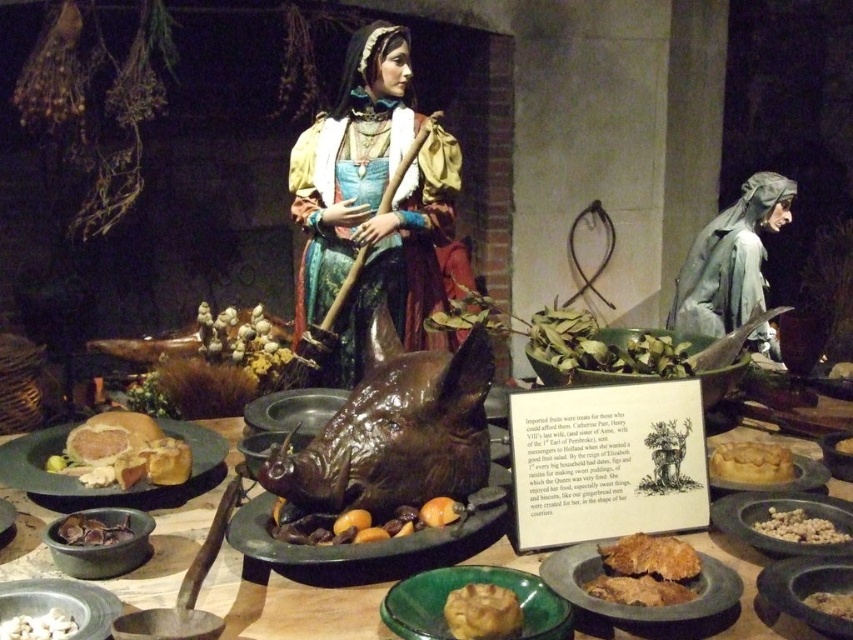
Question: Which object is farther from the camera taking this photo?

Choices:
 (A) matte gray bowl at lower left
 (B) brown matte beans at lower right
 (C) shiny brown mushrooms at center

Answer: (B)

Question: Can you confirm if shiny silver platter at center is positioned below brown matte bread at center?

Choices:
 (A) no
 (B) yes

Answer: (B)

Question: Is shiny brown pig head at center bigger than matte brown bowl at lower right?

Choices:
 (A) no
 (B) yes

Answer: (B)

Question: Does brown crumbly pastry at lower right have a larger size compared to orange matte fruit at center?

Choices:
 (A) no
 (B) yes

Answer: (A)

Question: Which point appears farthest from the camera in this image?

Choices:
 (A) (263, 508)
 (B) (701, 618)
 (C) (47, 628)
 (D) (752, 552)

Answer: (A)

Question: Which of the following is the closest to the observer?

Choices:
 (A) matte brown pastry at lower center
 (B) shiny silver platter at center

Answer: (A)